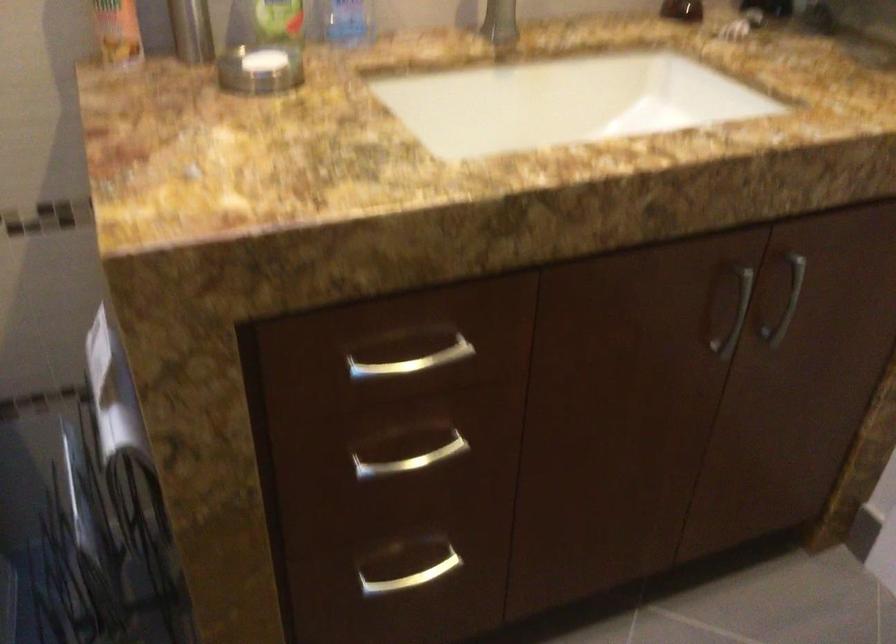
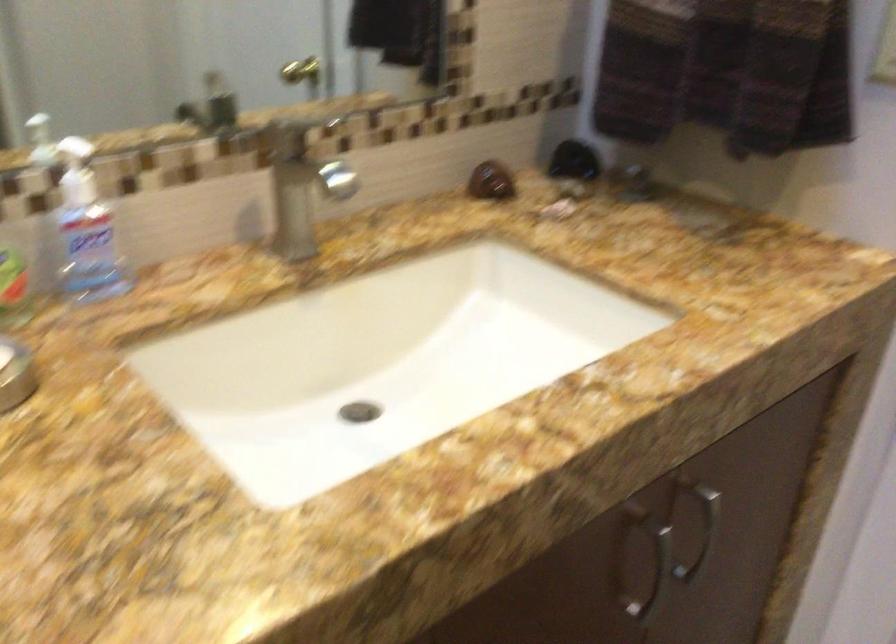
Question: Which direction would the cameraman need to move to produce the second image? Reply with the corresponding letter.

Choices:
 (A) Left
 (B) Right
 (C) Forward
 (D) Backward

Answer: (C)